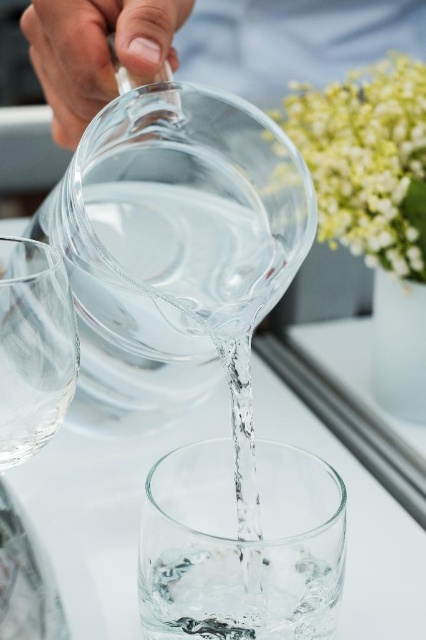
Is clear glass pitcher at upper center thinner than green leafy plant at upper right?

No.

Does clear glass pitcher at upper center appear on the right side of green leafy plant at upper right?

In fact, clear glass pitcher at upper center is to the left of green leafy plant at upper right.

Is point (236, 48) behind point (416, 250)?

Yes.

Where is `clear glass pitcher at upper center`? The image size is (426, 640). clear glass pitcher at upper center is located at coordinates (207, 45).

Is point (296, 42) farther from viewer compared to point (25, 596)?

That is True.

Does clear glass pitcher at upper center appear on the right side of transparent glass wine glass at left?

Correct, you'll find clear glass pitcher at upper center to the right of transparent glass wine glass at left.

Is point (238, 60) less distant than point (5, 372)?

That is False.

In order to click on clear glass pitcher at upper center in this screenshot , I will do 207,45.

Does point (386, 193) come farther from viewer compared to point (2, 509)?

Yes, point (386, 193) is farther from viewer.

Is green leafy plant at upper right closer to camera compared to transparent glass wine glass at left?

No, it is not.

The image size is (426, 640). Describe the element at coordinates (368, 161) in the screenshot. I see `green leafy plant at upper right` at that location.

Find the location of a particular element. The height and width of the screenshot is (640, 426). green leafy plant at upper right is located at coordinates (368, 161).